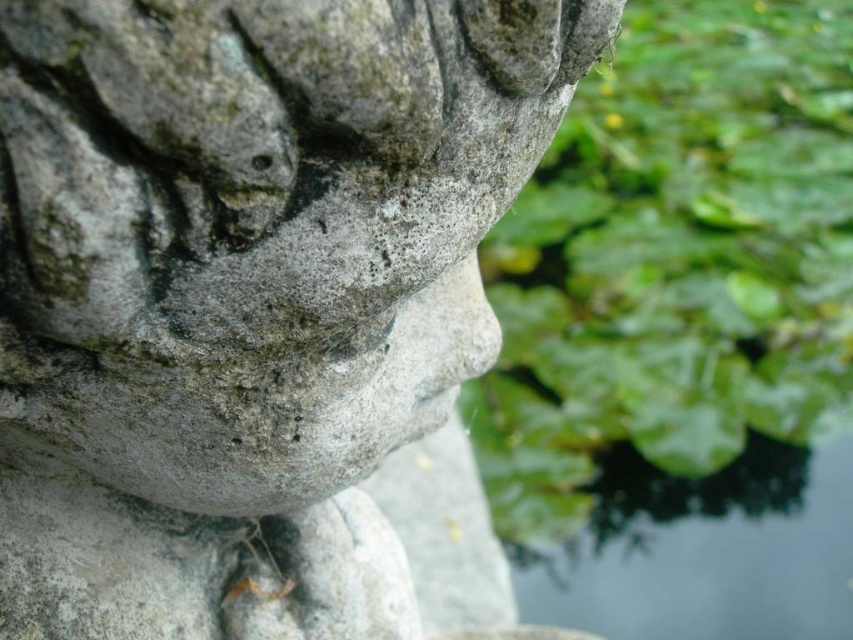
Can you confirm if gray stone statue at center is bigger than transparent water at lower right?

Yes.

The width and height of the screenshot is (853, 640). I want to click on gray stone statue at center, so click(256, 305).

The height and width of the screenshot is (640, 853). Identify the location of gray stone statue at center. (256, 305).